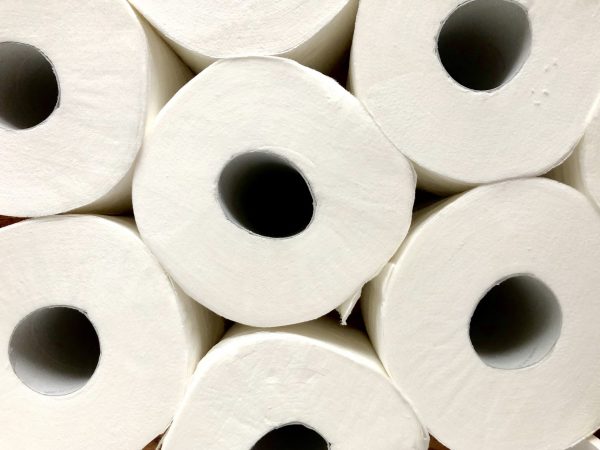
Locate an element on the screen. This screenshot has height=450, width=600. center of toilet paper roll is located at coordinates (57, 359), (18, 92), (260, 198), (479, 52), (511, 328), (289, 448).